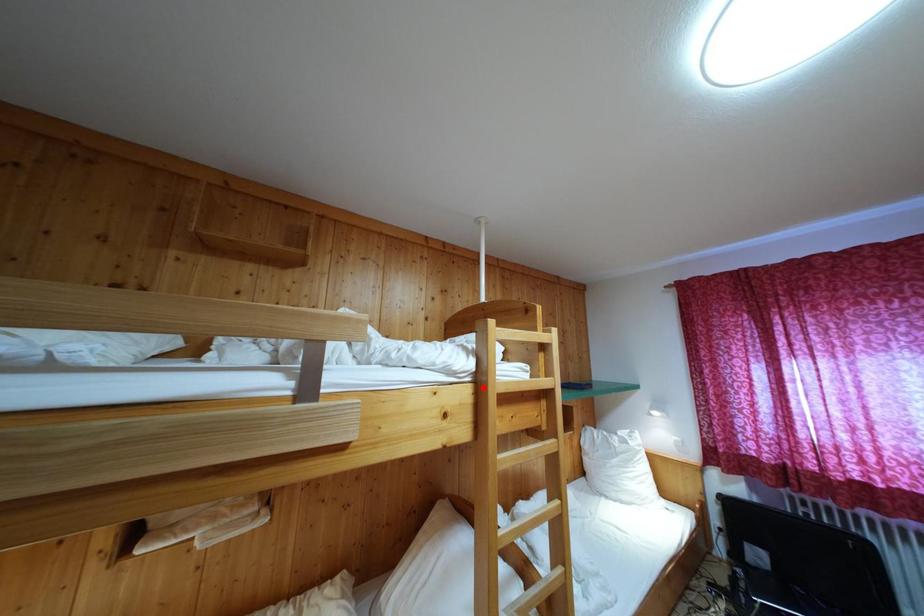
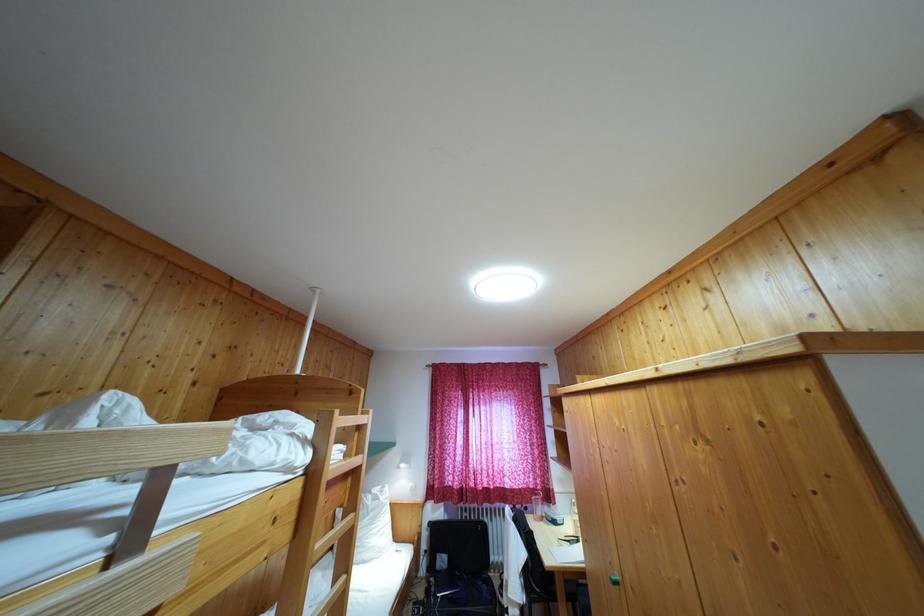
Where in the second image is the point corresponding to the highlighted location from the first image?

(317, 479)